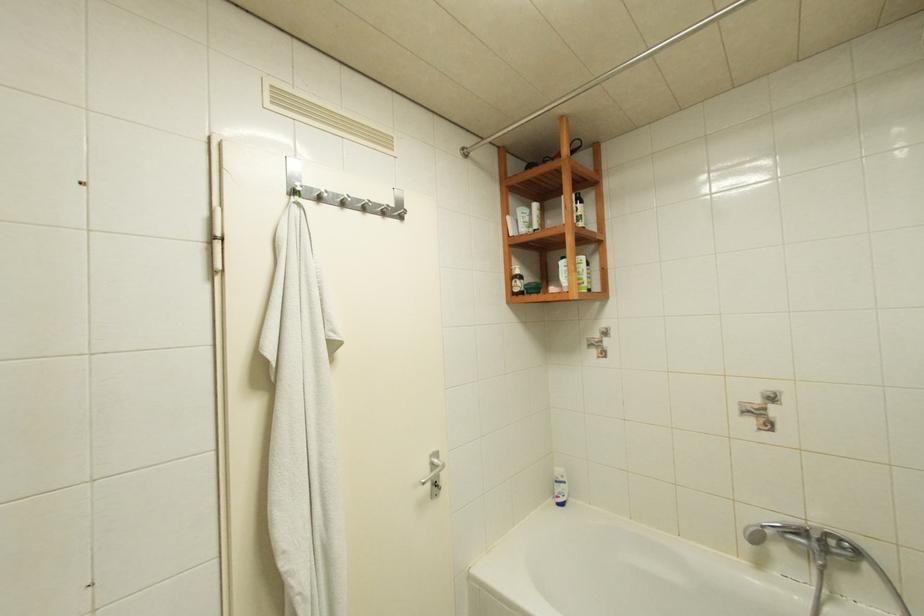
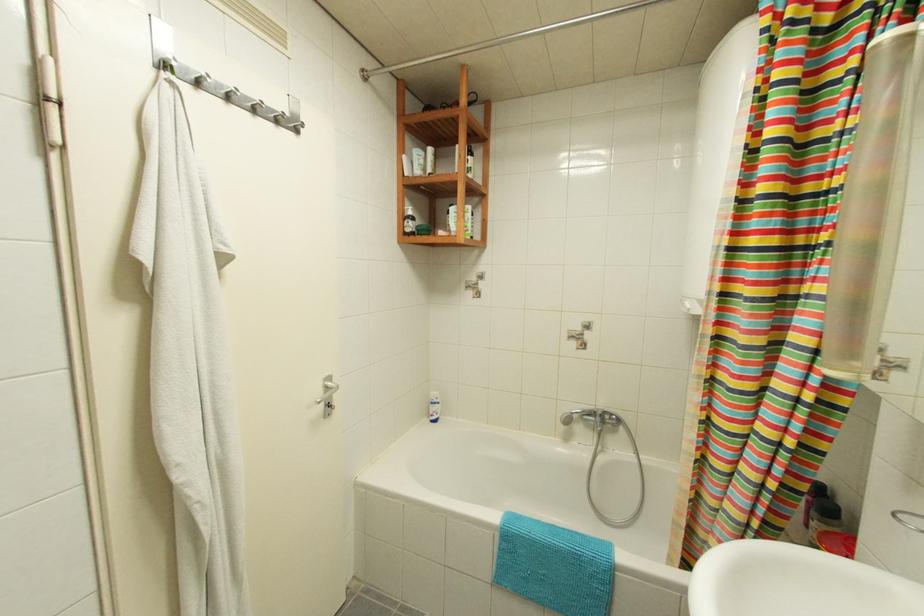
Question: Based on the continuous images, in which direction is the camera rotating? Reply with the corresponding letter.

Choices:
 (A) Left
 (B) Right
 (C) Up
 (D) Down

Answer: (B)